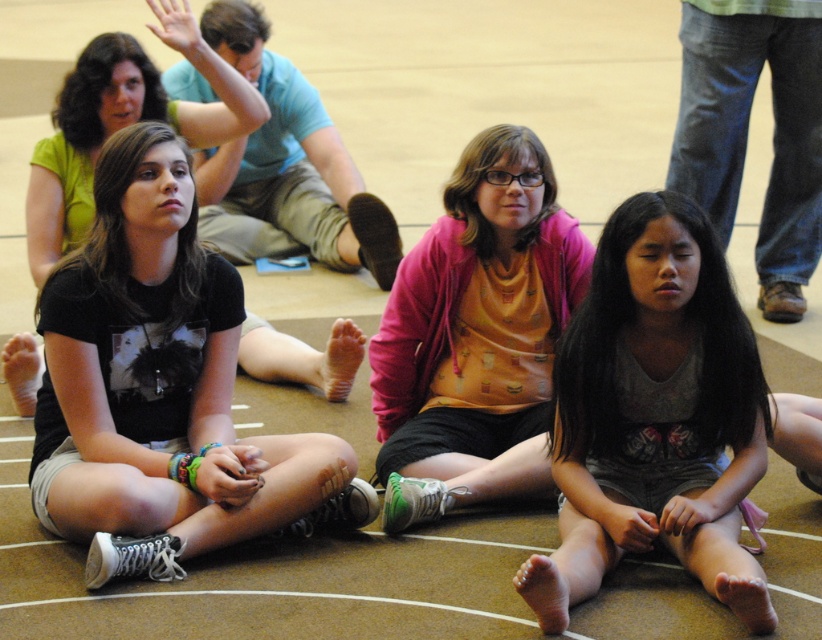
Question: Does gray cotton shorts at lower right appear over orange matte shirt at center?

Choices:
 (A) yes
 (B) no

Answer: (B)

Question: Which object appears farthest from the camera in this image?

Choices:
 (A) gray cotton shorts at lower right
 (B) orange matte shirt at center
 (C) black fabric shirt at center

Answer: (B)

Question: Is black fabric shirt at center wider than orange matte shirt at center?

Choices:
 (A) yes
 (B) no

Answer: (A)

Question: Among these objects, which one is nearest to the camera?

Choices:
 (A) matte black shirt at center
 (B) orange matte shirt at center
 (C) black fabric shirt at center
 (D) gray cotton shorts at lower right

Answer: (D)

Question: Among these objects, which one is farthest from the camera?

Choices:
 (A) black fabric shirt at center
 (B) orange matte shirt at center
 (C) matte black shirt at center
 (D) gray cotton shorts at lower right

Answer: (C)

Question: Does black fabric shirt at center appear on the right side of gray cotton shorts at lower right?

Choices:
 (A) no
 (B) yes

Answer: (A)